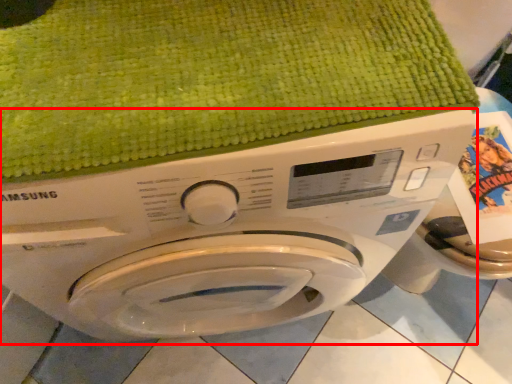
Question: From the image's perspective, considering the relative positions of washing machine (annotated by the red box) and bath towel in the image provided, where is washing machine (annotated by the red box) located with respect to the staircase?

Choices:
 (A) below
 (B) above

Answer: (A)